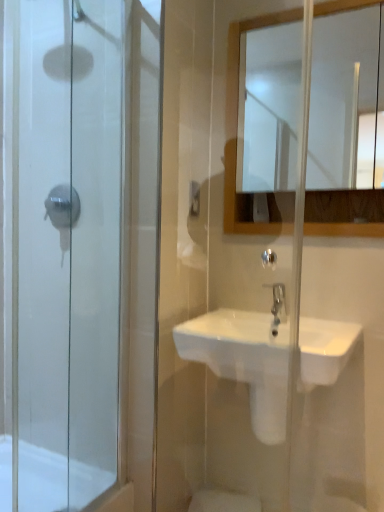
Question: Considering the relative sizes of white glossy mirror at upper center and transparent glass shower door at left in the image provided, is white glossy mirror at upper center bigger than transparent glass shower door at left?

Choices:
 (A) yes
 (B) no

Answer: (B)

Question: Does white glossy mirror at upper center contain transparent glass shower door at left?

Choices:
 (A) yes
 (B) no

Answer: (B)

Question: Is white glossy mirror at upper center facing towards transparent glass shower door at left?

Choices:
 (A) no
 (B) yes

Answer: (A)

Question: From a real-world perspective, is white glossy mirror at upper center physically below transparent glass shower door at left?

Choices:
 (A) no
 (B) yes

Answer: (A)

Question: Is the position of white glossy mirror at upper center more distant than that of transparent glass shower door at left?

Choices:
 (A) yes
 (B) no

Answer: (A)

Question: Can you confirm if white glossy mirror at upper center is positioned to the right of transparent glass shower door at left?

Choices:
 (A) no
 (B) yes

Answer: (B)

Question: Considering the relative positions of satin nickel faucet at center and white glossy mirror at upper center in the image provided, is satin nickel faucet at center in front of white glossy mirror at upper center?

Choices:
 (A) no
 (B) yes

Answer: (A)

Question: Is satin nickel faucet at center to the left of white glossy mirror at upper center from the viewer's perspective?

Choices:
 (A) yes
 (B) no

Answer: (A)

Question: From the image's perspective, is satin nickel faucet at center above white glossy mirror at upper center?

Choices:
 (A) no
 (B) yes

Answer: (A)

Question: Considering the relative sizes of satin nickel faucet at center and white glossy mirror at upper center in the image provided, is satin nickel faucet at center shorter than white glossy mirror at upper center?

Choices:
 (A) yes
 (B) no

Answer: (A)

Question: Is satin nickel faucet at center behind white glossy mirror at upper center?

Choices:
 (A) no
 (B) yes

Answer: (B)

Question: Is satin nickel faucet at center located outside white glossy mirror at upper center?

Choices:
 (A) yes
 (B) no

Answer: (A)

Question: Considering the relative sizes of white glossy mirror at upper center and satin nickel faucet at center in the image provided, is white glossy mirror at upper center thinner than satin nickel faucet at center?

Choices:
 (A) yes
 (B) no

Answer: (A)